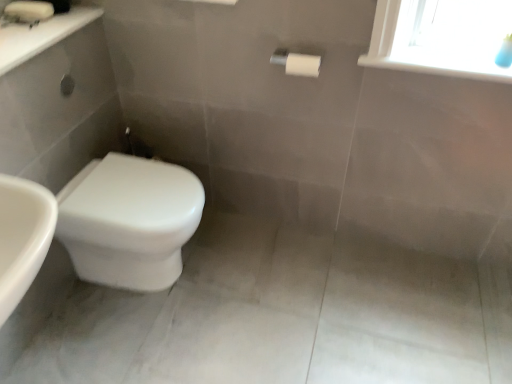
Question: Is white glossy sink at upper left facing away from white plastic window sill at upper right?

Choices:
 (A) yes
 (B) no

Answer: (B)

Question: From a real-world perspective, is white glossy sink at upper left located beneath white plastic window sill at upper right?

Choices:
 (A) no
 (B) yes

Answer: (A)

Question: Considering the relative sizes of white glossy sink at upper left and white plastic window sill at upper right in the image provided, is white glossy sink at upper left wider than white plastic window sill at upper right?

Choices:
 (A) yes
 (B) no

Answer: (A)

Question: Considering the relative positions of white glossy sink at upper left and white plastic window sill at upper right in the image provided, is white glossy sink at upper left to the right of white plastic window sill at upper right from the viewer's perspective?

Choices:
 (A) no
 (B) yes

Answer: (A)

Question: From the image's perspective, is white glossy sink at upper left on white plastic window sill at upper right?

Choices:
 (A) yes
 (B) no

Answer: (A)

Question: From their relative heights in the image, would you say white plastic window sill at upper right is taller or shorter than white glossy sink at upper left?

Choices:
 (A) tall
 (B) short

Answer: (B)

Question: From a real-world perspective, relative to white glossy sink at upper left, is white plastic window sill at upper right vertically above or below?

Choices:
 (A) below
 (B) above

Answer: (A)

Question: In the image, is white plastic window sill at upper right on the left side or the right side of white glossy sink at upper left?

Choices:
 (A) right
 (B) left

Answer: (A)

Question: Is white plastic window sill at upper right wider or thinner than white glossy sink at upper left?

Choices:
 (A) wide
 (B) thin

Answer: (B)

Question: Choose the correct answer: Is white glossy toilet at lower left inside white plastic window sill at upper right or outside it?

Choices:
 (A) inside
 (B) outside

Answer: (B)

Question: Considering the positions of white glossy toilet at lower left and white plastic window sill at upper right in the image, is white glossy toilet at lower left wider or thinner than white plastic window sill at upper right?

Choices:
 (A) thin
 (B) wide

Answer: (B)

Question: Is point (116, 223) positioned closer to the camera than point (459, 61)?

Choices:
 (A) farther
 (B) closer

Answer: (B)

Question: Considering the positions of white glossy toilet at lower left and white plastic window sill at upper right in the image, is white glossy toilet at lower left taller or shorter than white plastic window sill at upper right?

Choices:
 (A) tall
 (B) short

Answer: (A)

Question: From the image's perspective, is white glossy sink at upper left above or below white plastic window sill at upper right?

Choices:
 (A) below
 (B) above

Answer: (B)

Question: Choose the correct answer: Is white glossy sink at upper left inside white plastic window sill at upper right or outside it?

Choices:
 (A) outside
 (B) inside

Answer: (A)